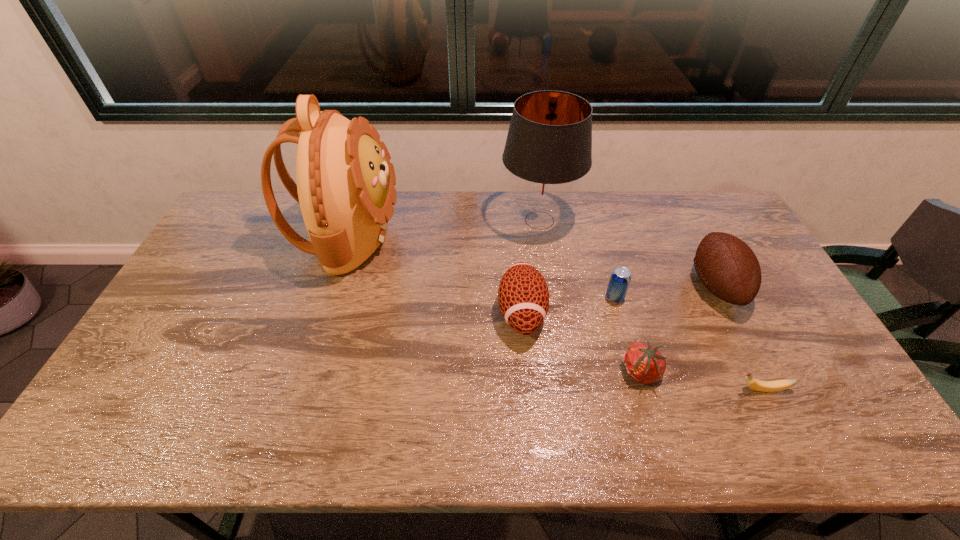
This screenshot has height=540, width=960. What are the coordinates of `football that is positioned at the right edge` in the screenshot? It's located at (727, 266).

Locate an element on the screen. The height and width of the screenshot is (540, 960). banana that is positioned at the right edge is located at coordinates (764, 386).

At what (x,y) coordinates should I click in order to perform the action: click on free region at the far edge. Please return your answer as a coordinate pair (x, y). The image size is (960, 540). Looking at the image, I should click on (478, 205).

In the image, there is a desktop. Where is `vacant region at the near edge`? vacant region at the near edge is located at coordinates (578, 430).

Image resolution: width=960 pixels, height=540 pixels. Find the location of `vacant space at the left edge of the desktop`. vacant space at the left edge of the desktop is located at coordinates (241, 256).

In the image, there is a desktop. Find the location of `vacant region at the right edge`. vacant region at the right edge is located at coordinates (818, 385).

I want to click on blank region between the tomato and the second tallest object, so click(x=590, y=296).

You are a GUI agent. You are given a task and a screenshot of the screen. Output one action in this format:
    pyautogui.click(x=<x>, y=<y>)
    Task: Click on the unoccupied position between the tomato and the second tallest object
    The image size is (960, 540).
    Given the screenshot: What is the action you would take?
    pyautogui.click(x=590, y=296)

Locate an element on the screen. This screenshot has width=960, height=540. empty space that is in between the lampshade and the right football is located at coordinates (628, 253).

This screenshot has height=540, width=960. Identify the location of vacant area that lies between the beer can and the left football. (568, 305).